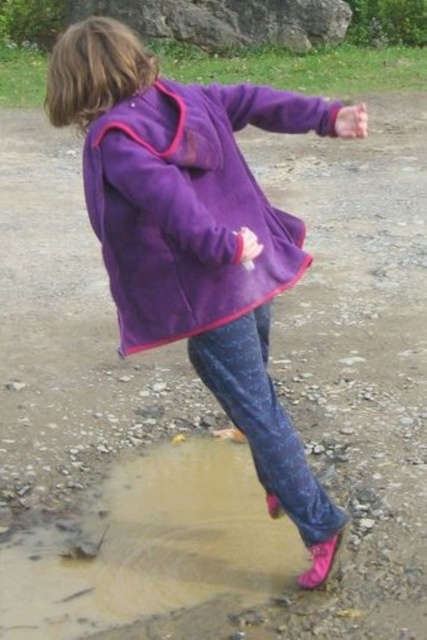
You are a photographer trying to capture the child in the purple fleece jacket at center and the smooth gray rock at upper center in the same frame. Which object will appear larger in your photo?

The purple fleece jacket at center will appear larger in the photo because it is closer to the viewer than the smooth gray rock at upper center.

You are a photographer trying to capture the child jumping. You notice the purple fleece jacket at center and the smooth gray rock at upper center in your viewfinder. Which object should you focus on first if you want to ensure the child is sharply captured?

The purple fleece jacket at center is located below the smooth gray rock at upper center, so focusing on the purple fleece jacket at center would ensure the child is sharply captured since it is closer to the camera.

You are a photographer trying to capture the child in the purple fleece jacket at center and the smooth gray rock at upper center in the same frame. Based on their sizes, which object would appear closer to the camera?

The purple fleece jacket at center appears closer to the camera because it has a smaller size compared to the smooth gray rock at upper center, indicating it is farther away.